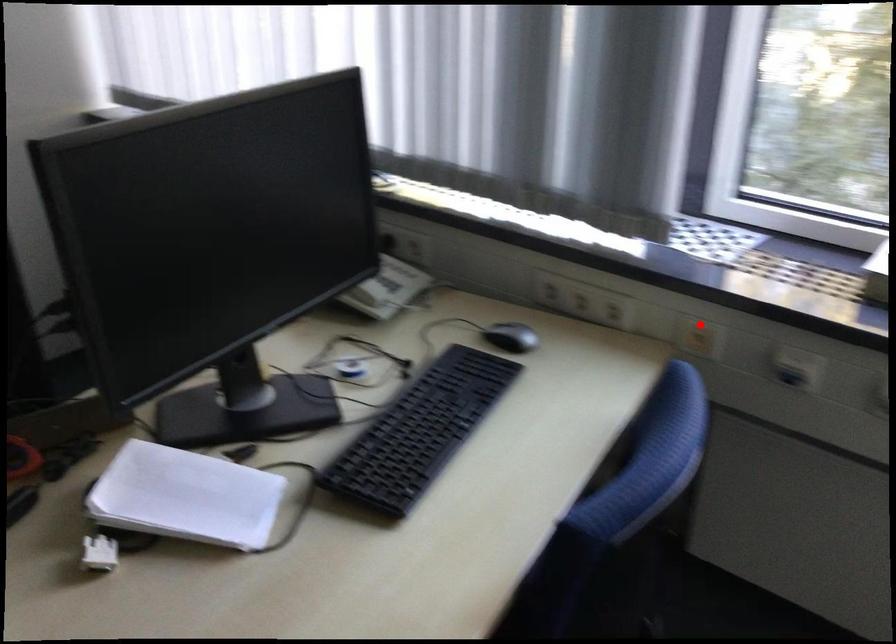
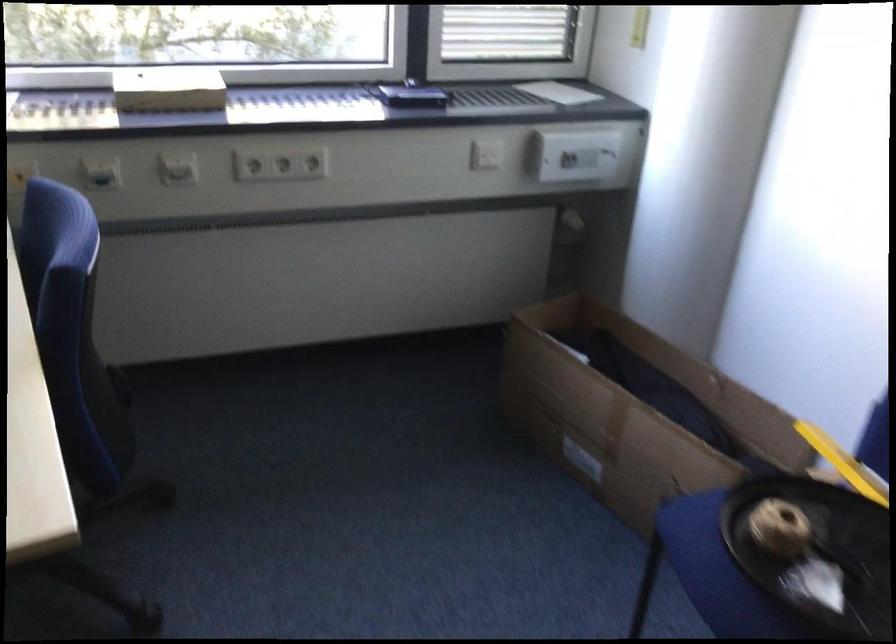
The point at the highlighted location is marked in the first image. Where is the corresponding point in the second image?

(20, 174)